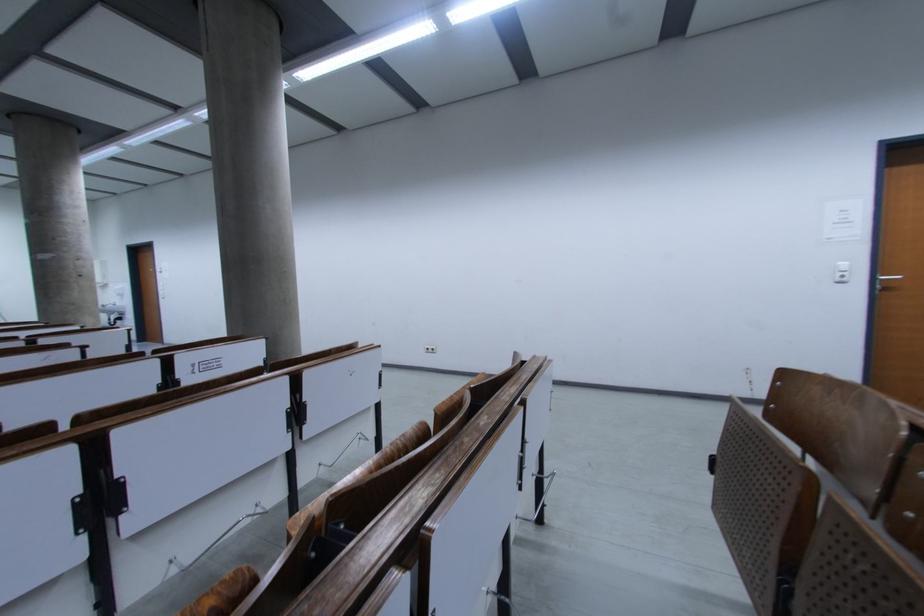
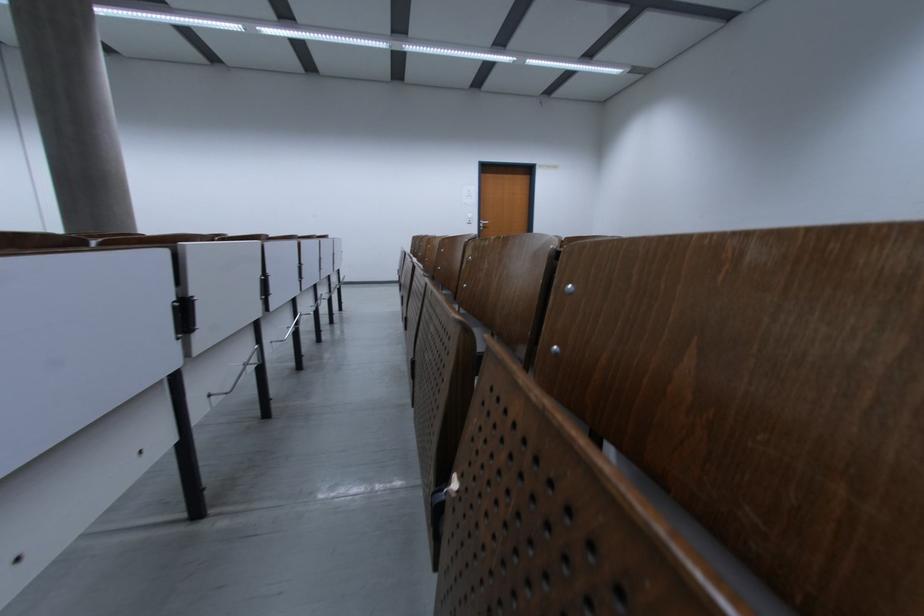
In the second image, find the point that corresponds to (x=840, y=225) in the first image.

(470, 199)